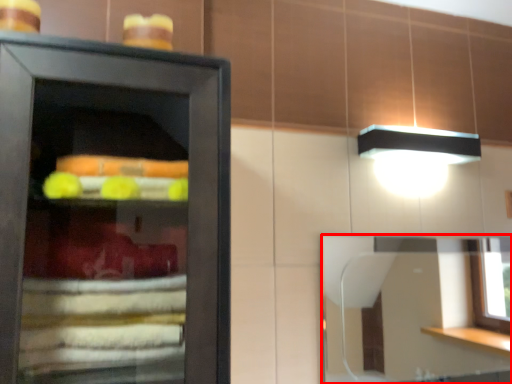
Question: Where is mirror (annotated by the red box) located in relation to food in the image?

Choices:
 (A) right
 (B) left

Answer: (A)